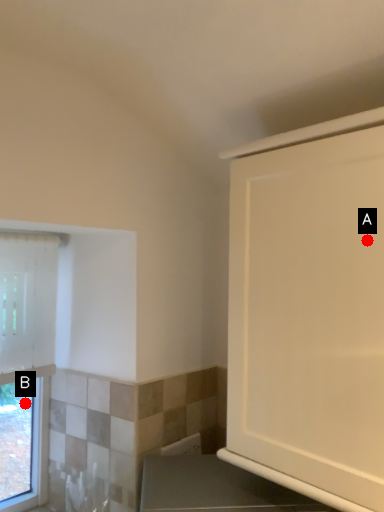
Question: Two points are circled on the image, labeled by A and B beside each circle. Among these points, which one is nearest to the camera?

Choices:
 (A) A is closer
 (B) B is closer

Answer: (A)